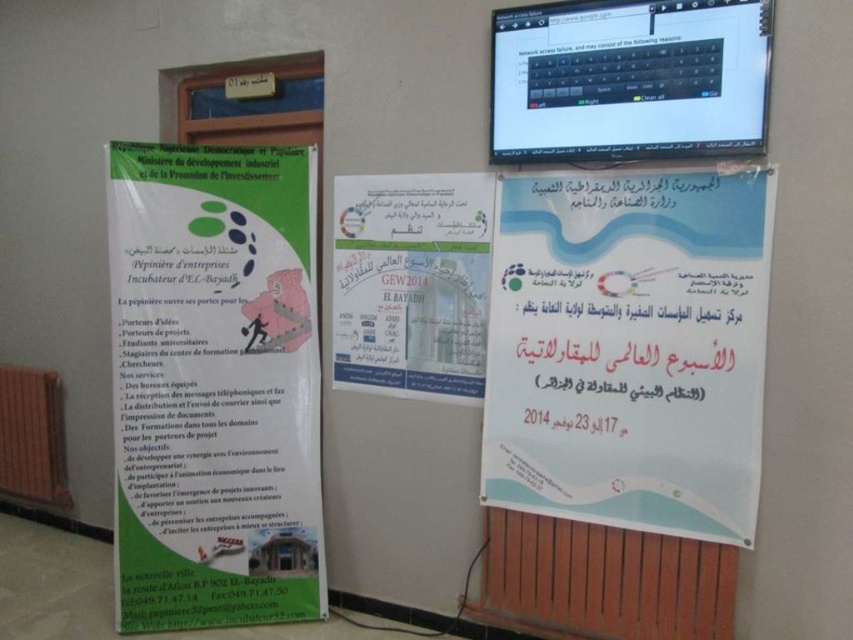
Question: Is the position of white paper poster at center more distant than that of white paper at center?

Choices:
 (A) yes
 (B) no

Answer: (B)

Question: From the image, what is the correct spatial relationship of matte green poster at left in relation to white paper poster at center?

Choices:
 (A) left
 (B) right

Answer: (A)

Question: Estimate the real-world distances between objects in this image. Which object is farther from the matte green poster at left?

Choices:
 (A) white paper poster at center
 (B) white paper at center

Answer: (A)

Question: Can you confirm if matte green poster at left is bigger than white paper at center?

Choices:
 (A) no
 (B) yes

Answer: (B)

Question: Which of the following is the closest to the observer?

Choices:
 (A) white paper poster at center
 (B) matte green poster at left
 (C) white paper at center

Answer: (A)

Question: Which point appears closest to the camera in this image?

Choices:
 (A) tap(606, 352)
 (B) tap(148, 480)

Answer: (A)